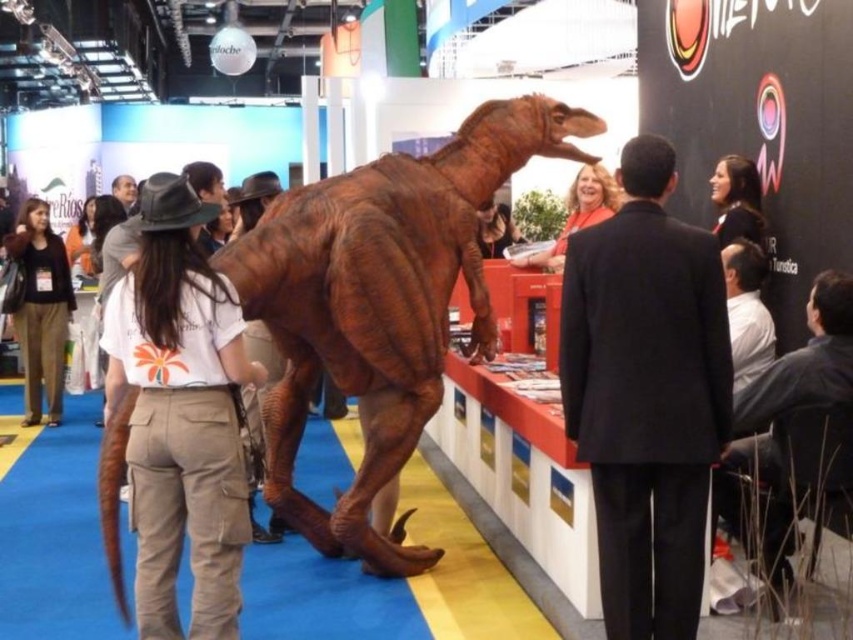
Question: Which object appears farthest from the camera in this image?

Choices:
 (A) black suit at center
 (B) matte black shirt at upper right

Answer: (B)

Question: Can you confirm if brown textured dinosaur at center is positioned above dark gray suit at right?

Choices:
 (A) no
 (B) yes

Answer: (B)

Question: Which point is closer to the camera?

Choices:
 (A) dark gray suit at right
 (B) matte khaki pants at left
 (C) smooth brown dinosaur at center
 (D) matte brown dinosaur at center

Answer: (A)

Question: Does dark gray suit at right come behind matte brown dinosaur at center?

Choices:
 (A) no
 (B) yes

Answer: (A)

Question: Which object appears closest to the camera in this image?

Choices:
 (A) smooth brown dinosaur at center
 (B) matte black shirt at upper right

Answer: (B)

Question: Is brown textured dinosaur at center smaller than matte khaki pants at left?

Choices:
 (A) yes
 (B) no

Answer: (B)